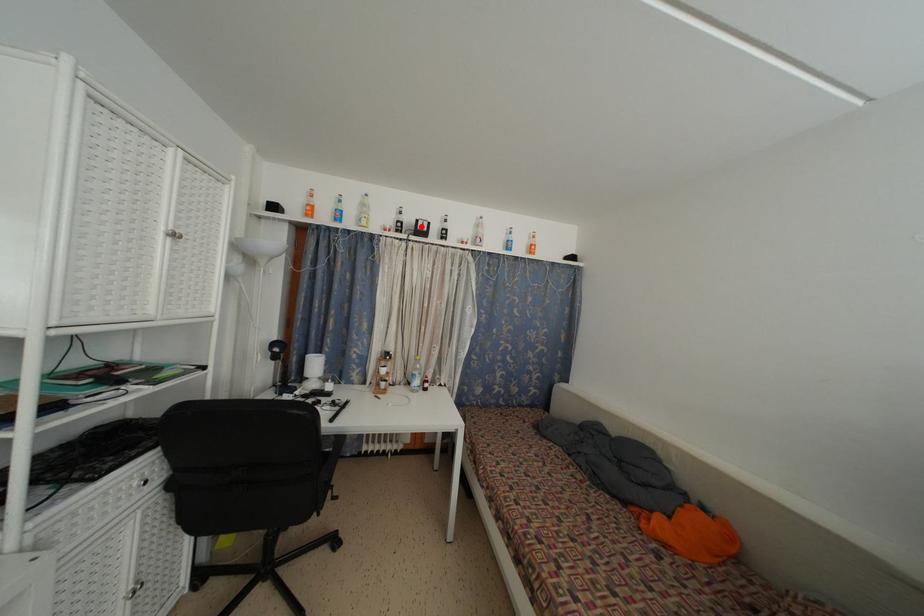
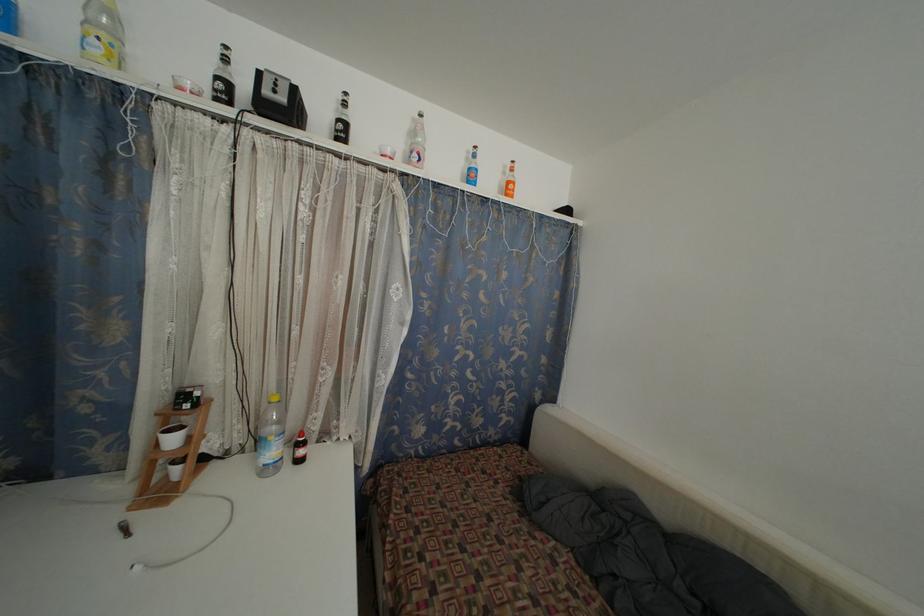
Find the pixel in the second image that matches the highlighted location in the first image.

(263, 79)